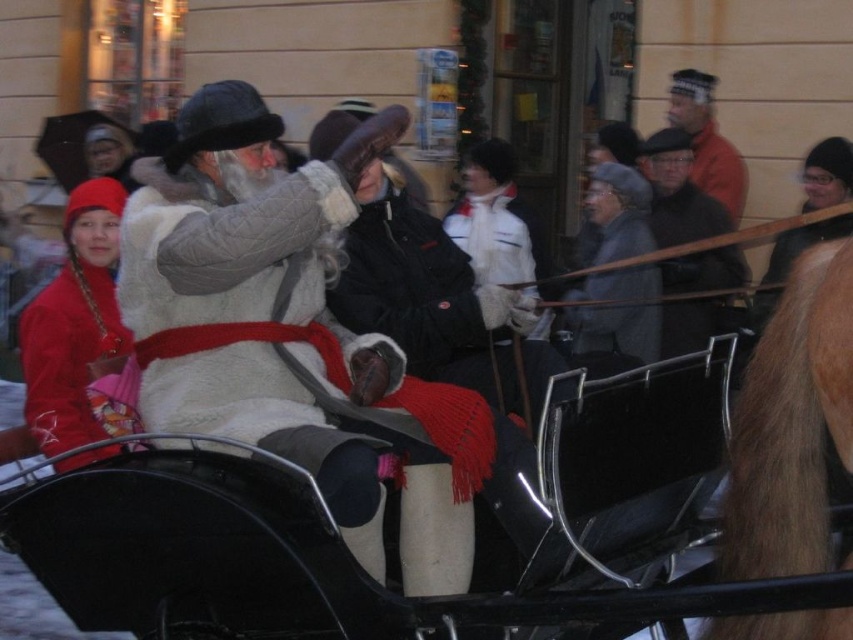
Does point (727, 230) come behind point (682, 90)?

No, it is not.

Who is positioned more to the right, dark gray wool coat at center or orange knit hat at upper right?

orange knit hat at upper right is more to the right.

Is point (705, 202) positioned behind point (712, 138)?

No, (705, 202) is closer to viewer.

The width and height of the screenshot is (853, 640). Find the location of `dark gray wool coat at center`. dark gray wool coat at center is located at coordinates (677, 192).

Which of these two, gray wool coat at center or orange knit hat at upper right, stands shorter?

orange knit hat at upper right is shorter.

This screenshot has height=640, width=853. I want to click on gray wool coat at center, so click(x=618, y=269).

The image size is (853, 640). I want to click on gray wool coat at center, so [618, 269].

Is point (780, 273) positioned after point (718, 173)?

No, it is not.

Which of these two, black knit hat at upper right or orange knit hat at upper right, stands taller?

With more height is orange knit hat at upper right.

The image size is (853, 640). I want to click on black knit hat at upper right, so click(x=827, y=173).